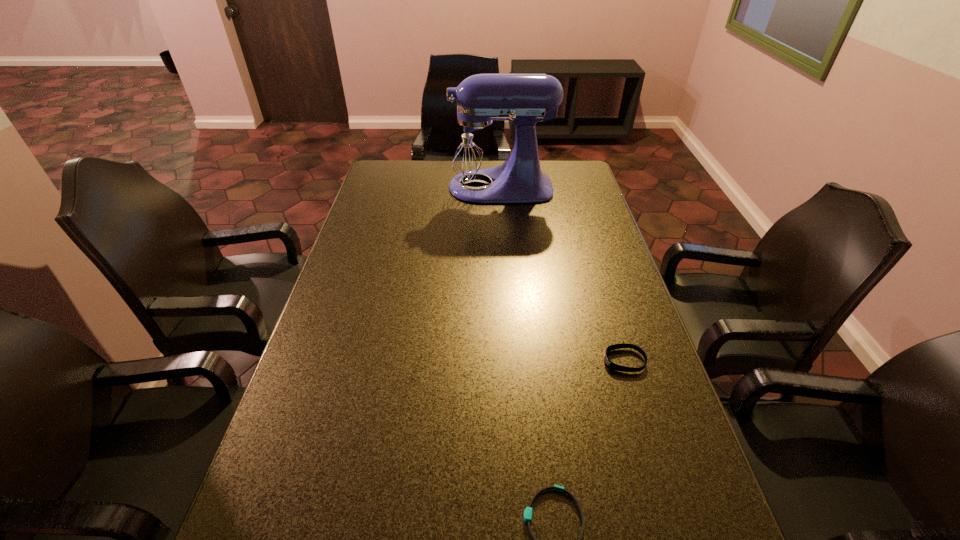
Where is `vacant space that's between the taller wristband and the farthest object`? The height and width of the screenshot is (540, 960). vacant space that's between the taller wristband and the farthest object is located at coordinates (561, 274).

Where is `unoccupied area between the rightmost object and the mixer`? unoccupied area between the rightmost object and the mixer is located at coordinates (561, 274).

Where is `blank region between the right wristband and the mixer`? blank region between the right wristband and the mixer is located at coordinates (561, 274).

Where is `the closest object to the second tallest object`? This screenshot has height=540, width=960. the closest object to the second tallest object is located at coordinates (528, 511).

Identify which object is the second closest to the left wristband. Please provide its 2D coordinates. Your answer should be formatted as a tuple, i.e. [(x, y)], where the tuple contains the x and y coordinates of a point satisfying the conditions above.

[(475, 146)]